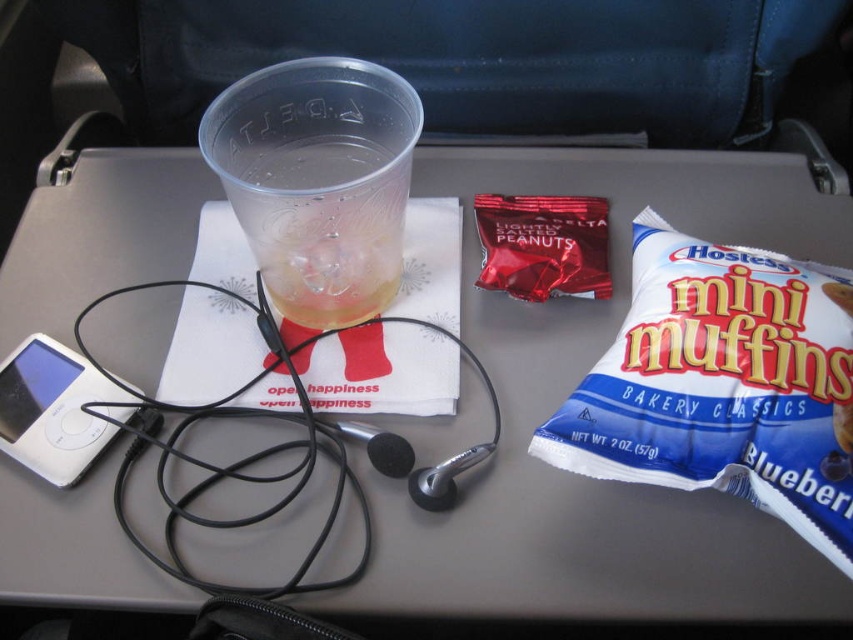
Looking at this image, can you confirm if blueberry paper mini muffins at upper right is smaller than white plastic ipod at lower left?

No, blueberry paper mini muffins at upper right is not smaller than white plastic ipod at lower left.

At what (x,y) coordinates should I click in order to perform the action: click on blueberry paper mini muffins at upper right. Please return your answer as a coordinate pair (x, y). Looking at the image, I should click on (723, 385).

Between blueberry paper mini muffins at upper right and shiny red peanuts at center, which one has less height?

shiny red peanuts at center is shorter.

I want to click on blueberry paper mini muffins at upper right, so click(723, 385).

Does point (309, 193) come closer to viewer compared to point (569, 275)?

Yes, point (309, 193) is closer to viewer.

Can you confirm if transparent plastic cup at upper center is thinner than shiny red peanuts at center?

Incorrect, transparent plastic cup at upper center's width is not less than shiny red peanuts at center's.

Which is behind, point (248, 134) or point (585, 202)?

Point (585, 202)

Locate an element on the screen. This screenshot has width=853, height=640. transparent plastic cup at upper center is located at coordinates (318, 180).